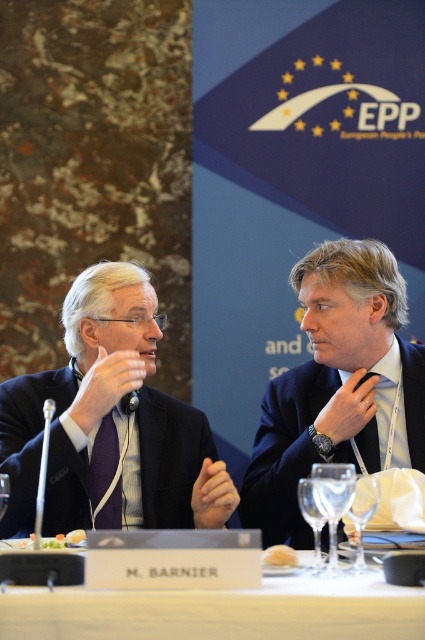
Which is in front, point (357, 552) or point (45, 477)?

Positioned in front is point (357, 552).

Who is positioned more to the left, transparent glass at lower center or silver metallic microphone at left?

silver metallic microphone at left

Where is `transparent glass at lower center`? The image size is (425, 640). transparent glass at lower center is located at coordinates click(x=362, y=515).

Can you confirm if satin blue suit at center is positioned to the right of dark blue suit at left?

Yes, satin blue suit at center is to the right of dark blue suit at left.

Between satin blue suit at center and dark blue suit at left, which one has less height?

dark blue suit at left is shorter.

Does point (306, 324) come behind point (54, 378)?

Yes, it is behind point (54, 378).

Locate an element on the screen. satin blue suit at center is located at coordinates (337, 385).

Is point (329, 570) farther from camera compared to point (363, 513)?

That is False.

This screenshot has width=425, height=640. What are the coordinates of `clear glass wine glass at lower center` in the screenshot? It's located at (333, 502).

Locate an element on the screen. The image size is (425, 640). clear glass wine glass at lower center is located at coordinates (333, 502).